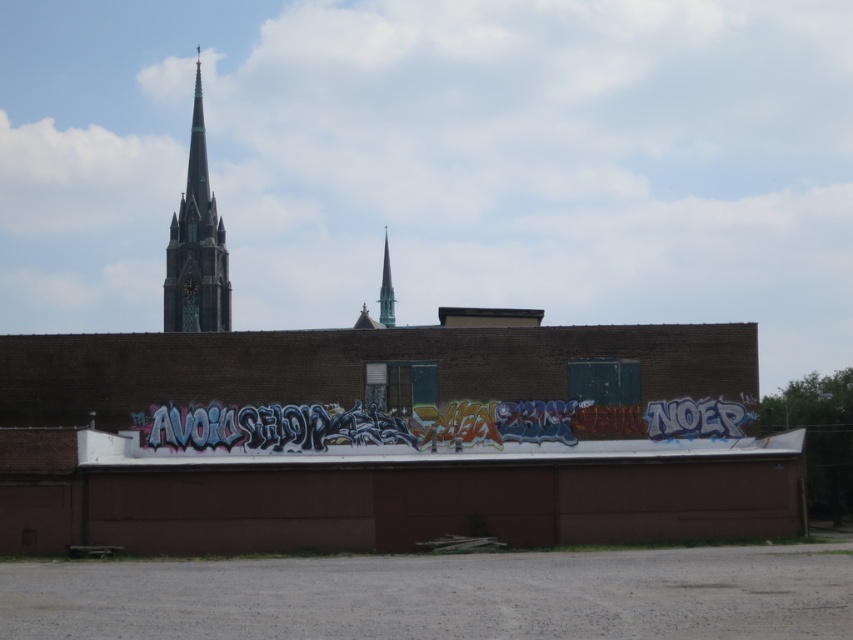
You are a photographer standing in front of the large brown brick building. You want to take a photo that includes both the dark green glass spire at upper left and the smooth glass spire at center. Which spire should you focus on first to ensure both are in frame?

You should focus on the dark green glass spire at upper left first because it is closer to the viewer than the smooth glass spire at center, so adjusting the camera to include it will naturally include the farther spire as well.

You are an architect analyzing the building layout. Which spire, the dark green glass spire at upper left or the smooth glass spire at center, is positioned further to the east?

The dark green glass spire at upper left is to the left of smooth glass spire at center, so it is positioned further to the east since it is on the left side.

You are an artist standing in front of the large brown brick building. You want to paint a new mural that will be visible from the street. Considering the multicolored graffiti at center and the dark green glass spire at upper left, which object is positioned closer to the street level?

The multicolored graffiti at center is closer to the viewer than the dark green glass spire at upper left, so the multicolored graffiti at center is positioned closer to the street level.